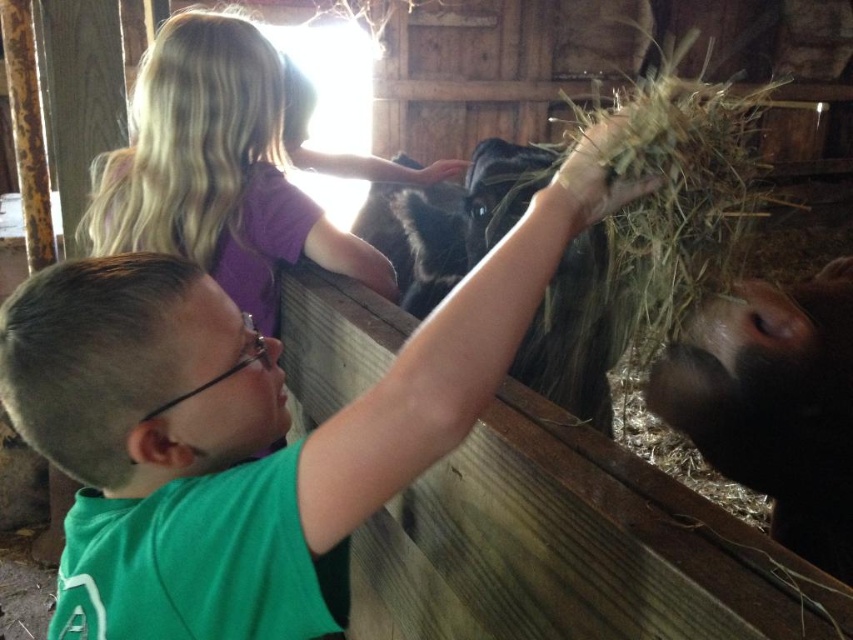
Does green matte shirt at upper center have a smaller size compared to black matte cow at right?

No, green matte shirt at upper center is not smaller than black matte cow at right.

Is point (125, 346) farther from camera compared to point (747, 348)?

No, (125, 346) is in front of (747, 348).

Find the location of `green matte shirt at upper center`. green matte shirt at upper center is located at coordinates (252, 419).